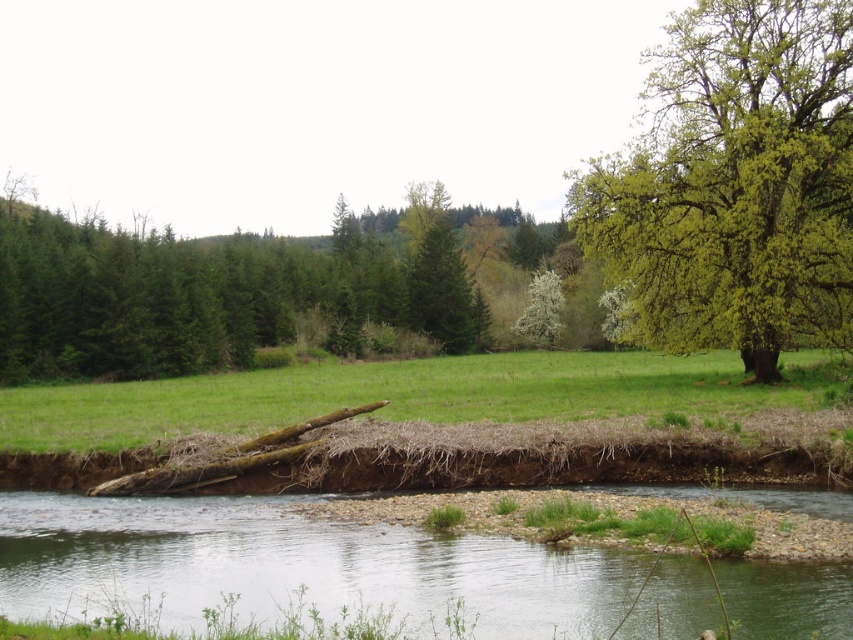
You are standing at the point marked by the coordinates point (409,396). Based on the scene description, what is the immediate surface you are standing on?

The point (409,396) marks green grassy at center, so you are standing on green grassy at center.